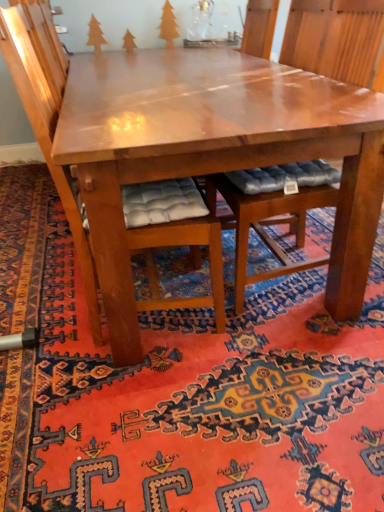
Where is `vacant area that is in front of wooden cushioned chair at center, the first chair in the left-to-right sequence`? The height and width of the screenshot is (512, 384). vacant area that is in front of wooden cushioned chair at center, the first chair in the left-to-right sequence is located at coordinates (150, 405).